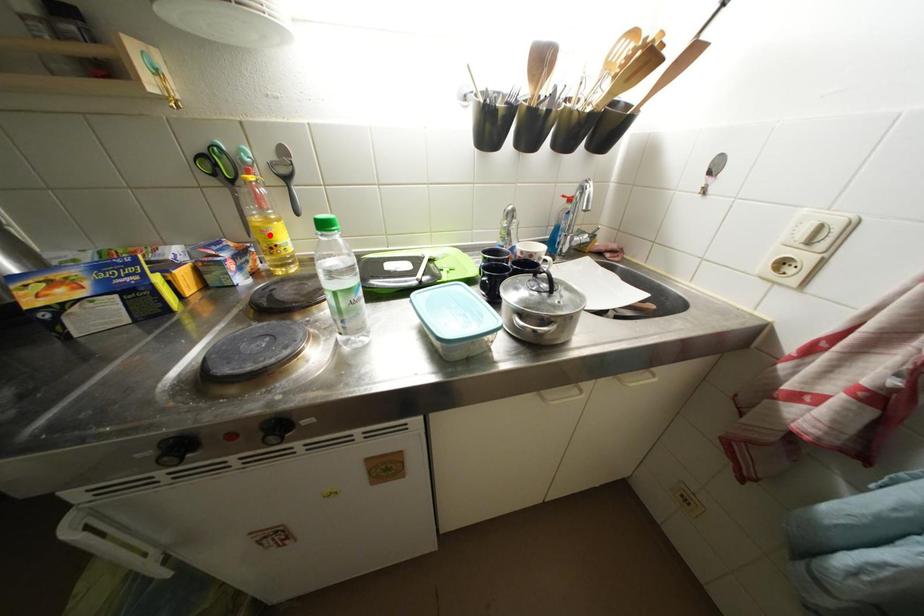
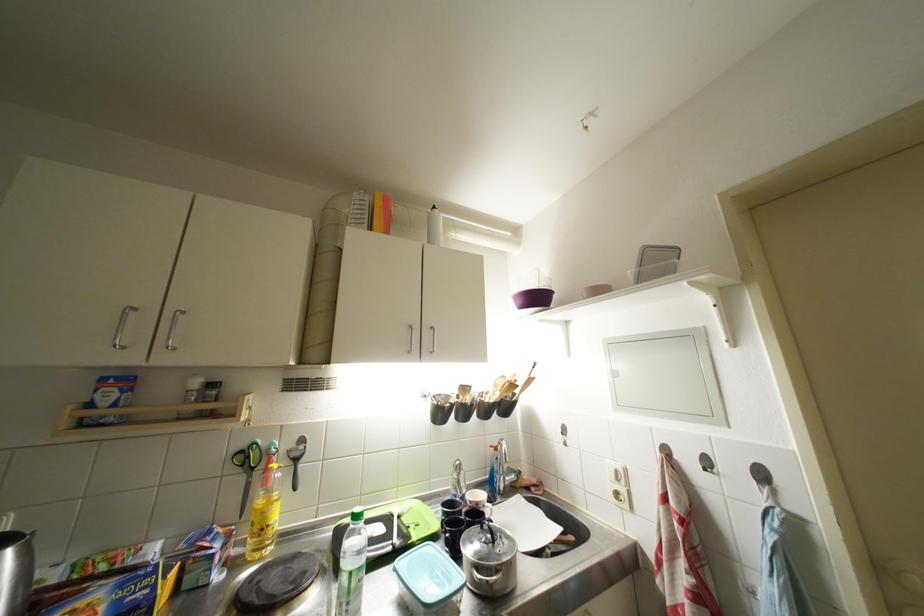
Where in the second image is the point corresponding to the highlighted location from the first image?

(271, 517)